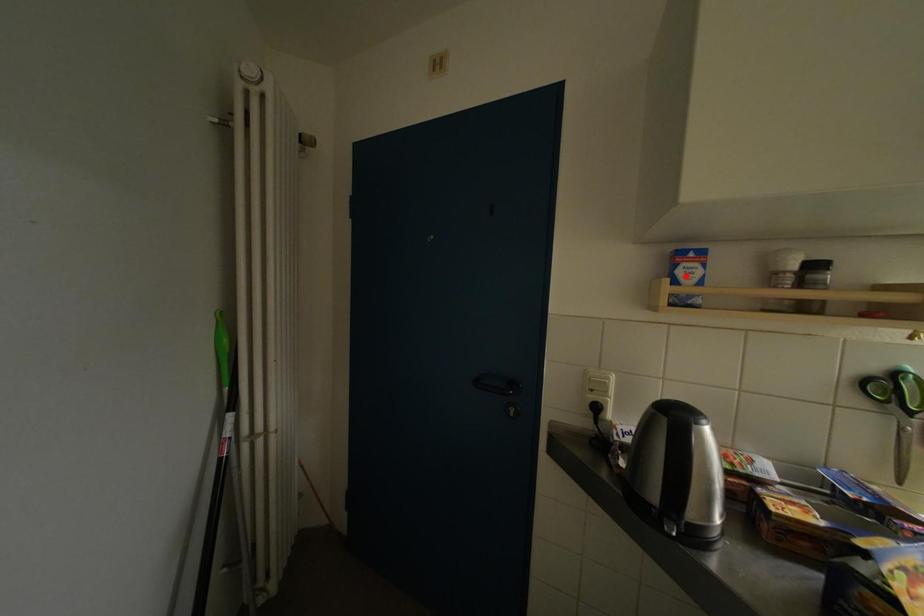
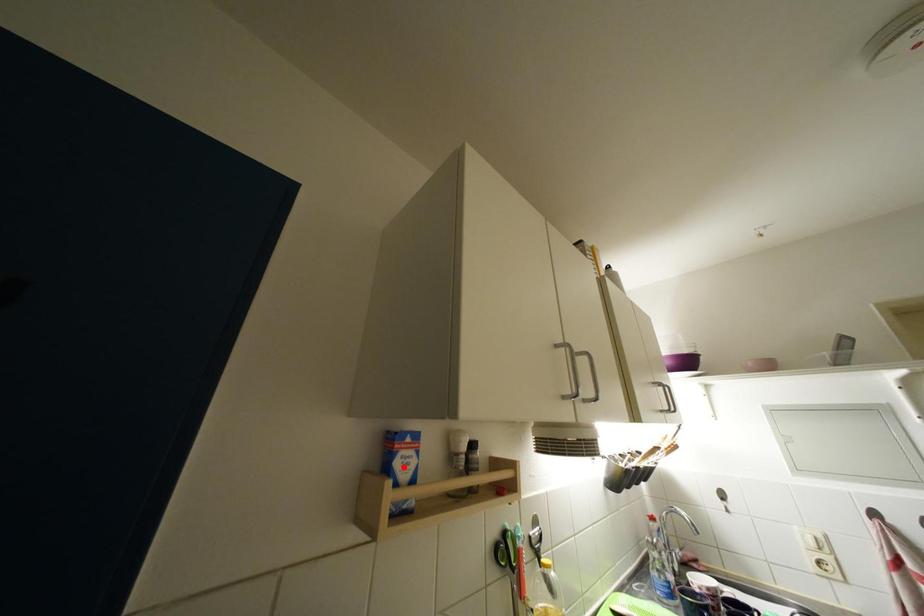
I am providing you with two images of the same scene from different viewpoints. A red point is marked on the first image and another point is marked on the second image. Do the highlighted points in image1 and image2 indicate the same real-world spot?

Yes